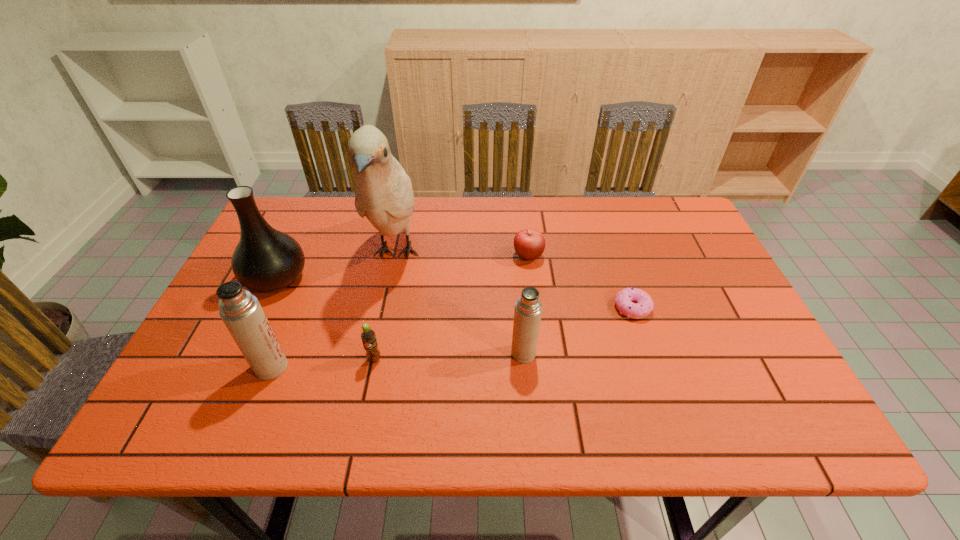
Image resolution: width=960 pixels, height=540 pixels. What are the coordinates of `vacant space located on the back of the shorter thermos bottle` in the screenshot? It's located at (516, 271).

What are the coordinates of `free space located 0.150m on the face of the parakeet` in the screenshot? It's located at pyautogui.click(x=376, y=349).

Locate an element on the screen. The image size is (960, 540). free space located on the left of the apple is located at coordinates (375, 256).

You are a GUI agent. You are given a task and a screenshot of the screen. Output one action in this format:
    pyautogui.click(x=<x>, y=<y>)
    Task: Click on the blank space located 0.130m on the front of the vase
    
    Given the screenshot: What is the action you would take?
    pyautogui.click(x=246, y=342)

Where is `vacant region located 0.230m on the right of the shortest object`? This screenshot has height=540, width=960. vacant region located 0.230m on the right of the shortest object is located at coordinates (741, 308).

In order to click on free region located on the front label of the third shortest object in this screenshot , I will do `click(367, 397)`.

The height and width of the screenshot is (540, 960). Identify the location of object that is at the far edge. (383, 193).

This screenshot has height=540, width=960. Identify the location of soda located in the near edge section of the desktop. [368, 336].

This screenshot has width=960, height=540. Find the location of `thermos bottle that is positioned at the left edge`. thermos bottle that is positioned at the left edge is located at coordinates (241, 312).

Locate an element on the screen. vase at the left edge is located at coordinates (265, 260).